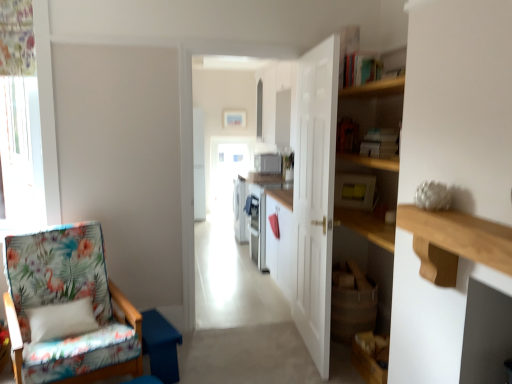
Question: Is white wooden door at center situated inside white glossy microwave at center or outside?

Choices:
 (A) inside
 (B) outside

Answer: (B)

Question: Considering the positions of point (330, 74) and point (253, 107), is point (330, 74) closer or farther from the camera than point (253, 107)?

Choices:
 (A) farther
 (B) closer

Answer: (B)

Question: Which is farther from the white glossy microwave at center?

Choices:
 (A) white glossy microwave at center, which is the 1th appliance in top-to-bottom order
 (B) floral fabric chair at left
 (C) wooden at right
 (D) white wooden door at center
 (E) yellow plastic microwave at upper center, placed as the second appliance when sorted from top to bottom

Answer: (C)

Question: Estimate the real-world distances between objects in this image. Which object is farther from the white glossy microwave at center?

Choices:
 (A) wooden at right
 (B) white glossy microwave at center, the 2th appliance positioned from the bottom
 (C) floral fabric chair at left
 (D) yellow plastic microwave at upper center, which is counted as the first appliance, starting from the bottom
 (E) white wooden door at center

Answer: (A)